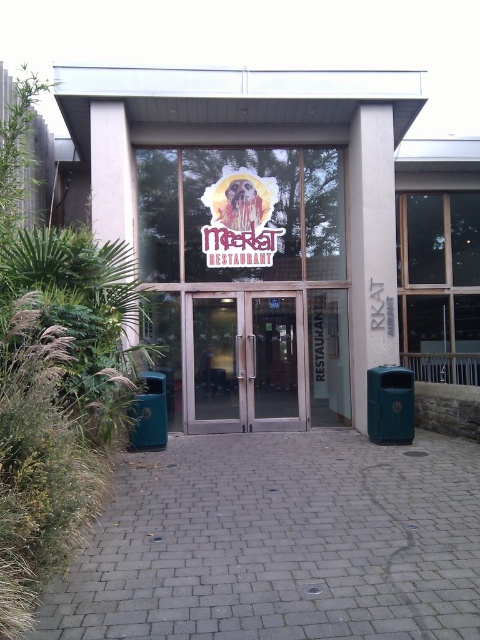
Is point (296, 397) behind point (232, 401)?

Yes, point (296, 397) is farther from viewer.

Does metallic glass door at center appear over transparent glass door at center?

No.

Between point (257, 369) and point (202, 369), which one is positioned behind?

The point (257, 369) is behind.

You are a GUI agent. You are given a task and a screenshot of the screen. Output one action in this format:
    pyautogui.click(x=<x>, y=<y>)
    Task: Click on the metallic glass door at center
    
    Given the screenshot: What is the action you would take?
    pyautogui.click(x=275, y=364)

Can you confirm if transparent glass doors at center is thinner than metallic glass door at center?

Incorrect, transparent glass doors at center's width is not less than metallic glass door at center's.

Measure the distance from transparent glass doors at center to metallic glass door at center.

A distance of 6.90 inches exists between transparent glass doors at center and metallic glass door at center.

Where is `transparent glass doors at center`? The image size is (480, 640). transparent glass doors at center is located at coordinates (244, 362).

Find the location of a particular element. The image size is (480, 640). transparent glass doors at center is located at coordinates (244, 362).